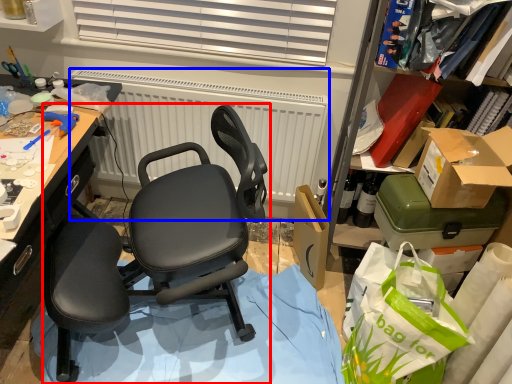
Question: Which object is closer to the camera taking this photo, chair (highlighted by a red box) or radiator (highlighted by a blue box)?

Choices:
 (A) chair
 (B) radiator

Answer: (A)